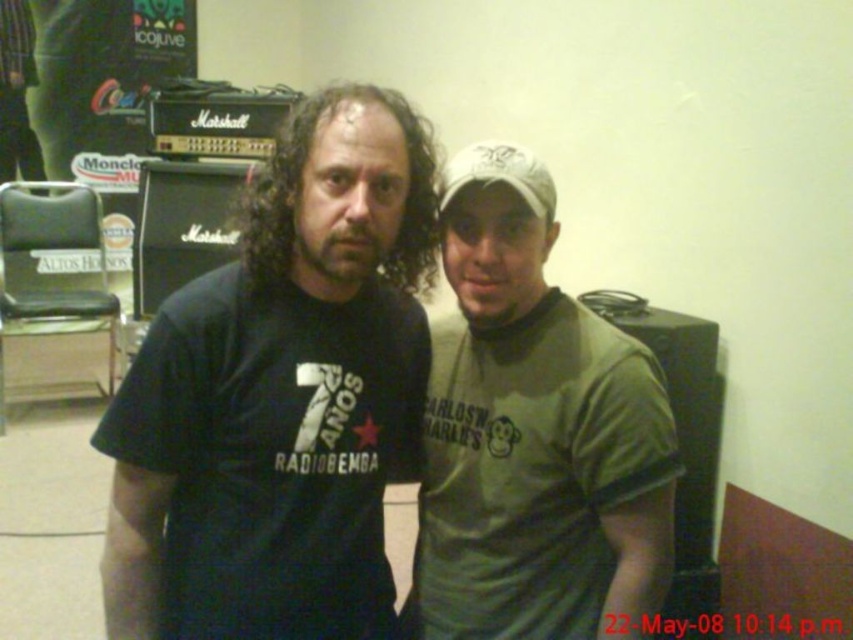
Question: Among these objects, which one is nearest to the camera?

Choices:
 (A) white matte baseball hat at upper center
 (B) green fabric pants at left
 (C) green matte t-shirt at center

Answer: (C)

Question: Is green matte t-shirt at center wider than white matte baseball hat at upper center?

Choices:
 (A) yes
 (B) no

Answer: (A)

Question: Is green fabric pants at left to the right of white matte baseball hat at upper center from the viewer's perspective?

Choices:
 (A) yes
 (B) no

Answer: (B)

Question: Which object is farther from the camera taking this photo?

Choices:
 (A) green matte t-shirt at center
 (B) white matte baseball hat at upper center
 (C) green fabric pants at left
 (D) black matte t-shirt at center

Answer: (C)

Question: Among these objects, which one is nearest to the camera?

Choices:
 (A) green matte t-shirt at center
 (B) white matte baseball hat at upper center
 (C) green fabric pants at left

Answer: (A)

Question: Does green matte t-shirt at center have a smaller size compared to white matte baseball hat at upper center?

Choices:
 (A) no
 (B) yes

Answer: (A)